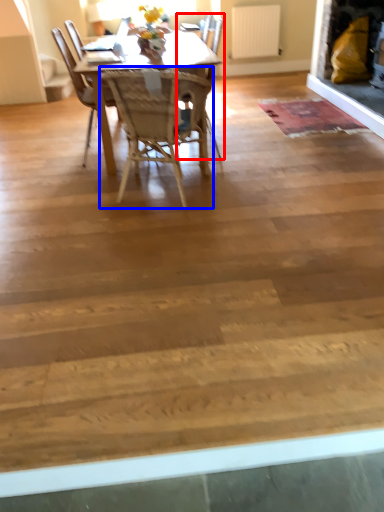
Question: Which object appears closest to the camera in this image, chair (highlighted by a red box) or chair (highlighted by a blue box)?

Choices:
 (A) chair
 (B) chair

Answer: (B)